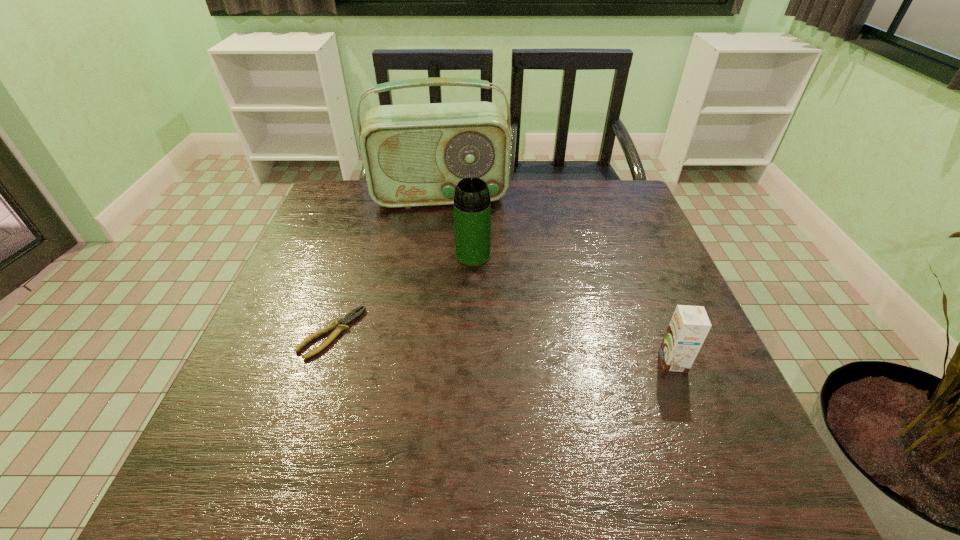
I want to click on the shortest object, so click(x=339, y=326).

You are a GUI agent. You are given a task and a screenshot of the screen. Output one action in this format:
    pyautogui.click(x=<x>, y=<y>)
    Task: Click on the rightmost object
    The width and height of the screenshot is (960, 540).
    Given the screenshot: What is the action you would take?
    pyautogui.click(x=689, y=326)

The image size is (960, 540). What are the coordinates of `chocolate milk` in the screenshot? It's located at (689, 326).

Image resolution: width=960 pixels, height=540 pixels. I want to click on the second farthest object, so click(472, 205).

The image size is (960, 540). I want to click on the third shortest object, so click(x=472, y=205).

The height and width of the screenshot is (540, 960). What are the coordinates of `the farthest object` in the screenshot? It's located at (414, 155).

Identify the location of the tallest object. [x=414, y=155].

At what (x,y) coordinates should I click in order to perform the action: click on vacant region located 0.240m on the right of the shortest object. Please return your answer as a coordinate pair (x, y). This screenshot has width=960, height=540. Looking at the image, I should click on (474, 333).

This screenshot has height=540, width=960. In order to click on free space located on the back of the chocolate milk in this screenshot , I will do `click(655, 316)`.

Where is `vacant space located 0.360m from the spout of the thermos bottle`? The image size is (960, 540). vacant space located 0.360m from the spout of the thermos bottle is located at coordinates (492, 392).